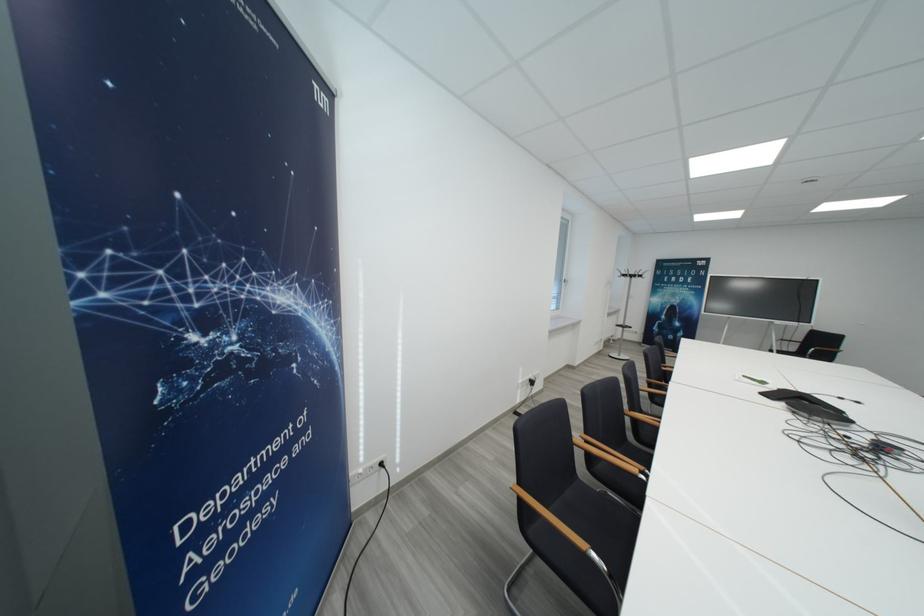
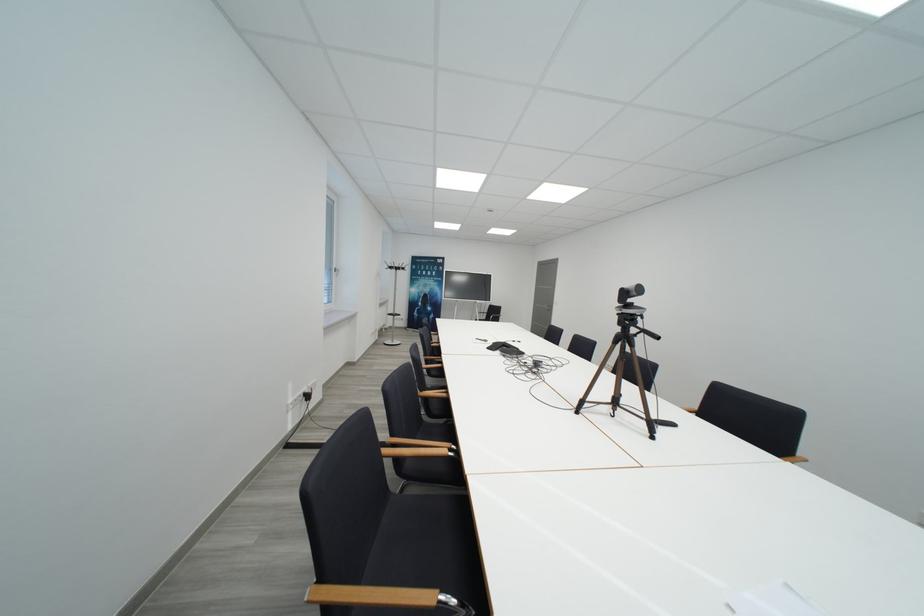
Locate, in the second image, the point that corresponds to point (567, 284) in the first image.

(337, 273)